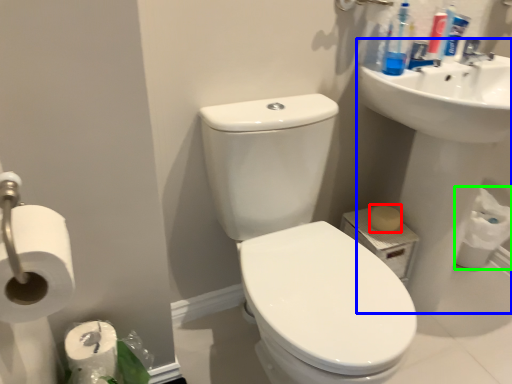
Question: Estimate the real-world distances between objects in this image. Which object is farther from soap (highlighted by a red box), sink (highlighted by a blue box) or toilet paper (highlighted by a green box)?

Choices:
 (A) sink
 (B) toilet paper

Answer: (B)